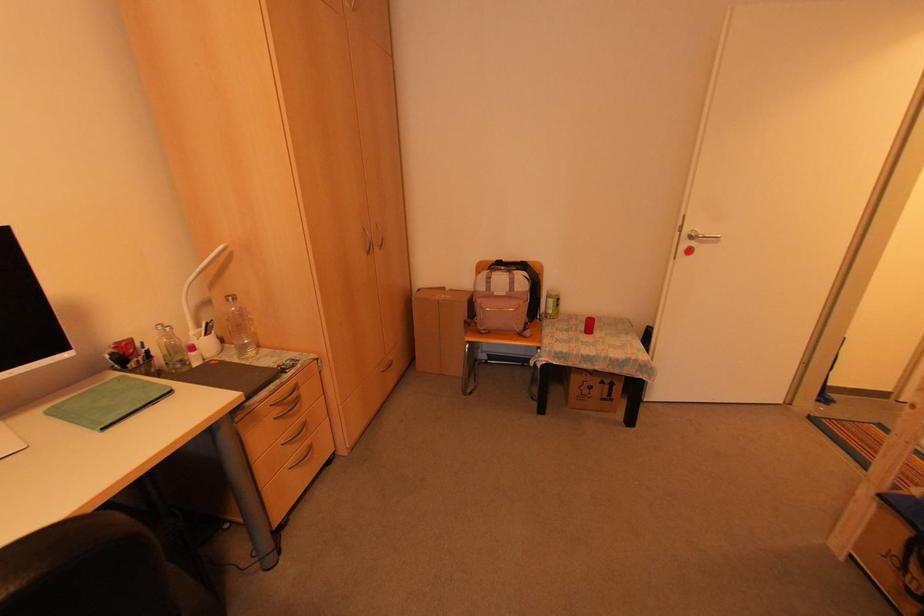
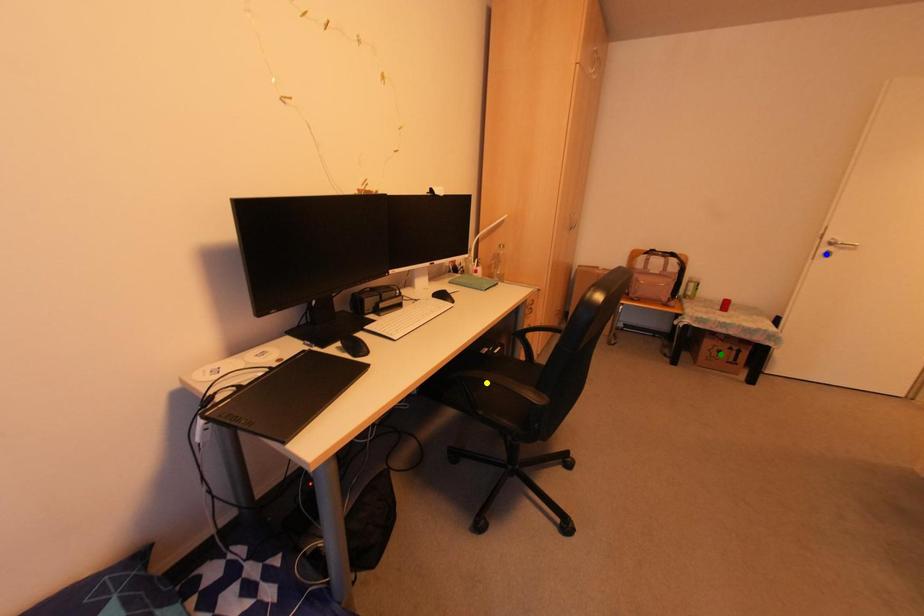
Question: I am providing you with two images of the same scene from different viewpoints. A red point is marked on the first image. You are given multiple points on the second image. Which spot in image 2 lines up with the point in image 1?

Choices:
 (A) blue point
 (B) yellow point
 (C) green point

Answer: (A)